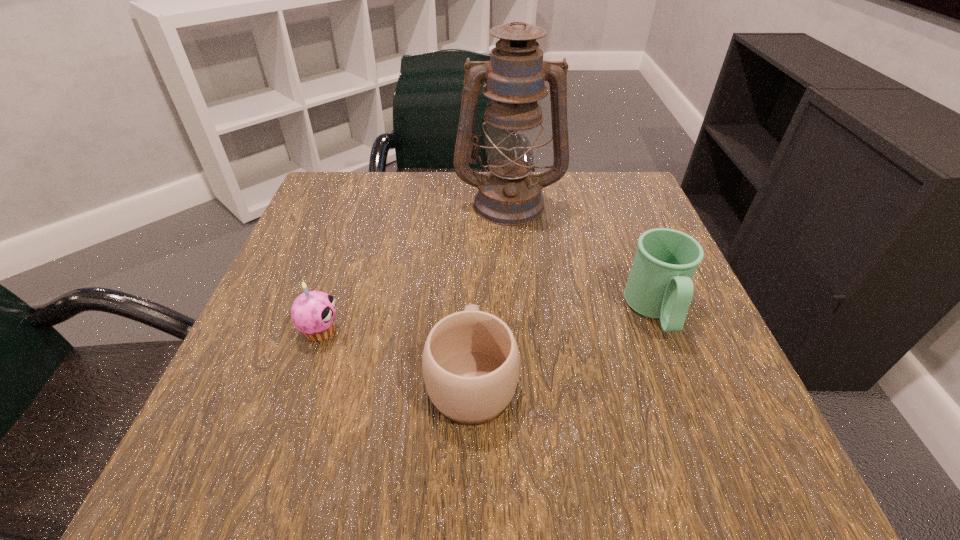
Where is `free space located on the side of the left mug with the handle`? The width and height of the screenshot is (960, 540). free space located on the side of the left mug with the handle is located at coordinates (473, 290).

I want to click on object present at the far edge, so click(x=509, y=194).

The image size is (960, 540). In order to click on object that is at the near edge in this screenshot , I will do `click(470, 361)`.

What are the coordinates of `object situated at the left edge` in the screenshot? It's located at (313, 313).

This screenshot has width=960, height=540. I want to click on object that is at the right edge, so click(660, 286).

Image resolution: width=960 pixels, height=540 pixels. In the image, there is a desktop. Find the location of `vacant space at the far edge`. vacant space at the far edge is located at coordinates (561, 180).

You are a GUI agent. You are given a task and a screenshot of the screen. Output one action in this format:
    pyautogui.click(x=<x>, y=<y>)
    Task: Click on the free location at the near edge of the desktop
    The width and height of the screenshot is (960, 540).
    Given the screenshot: What is the action you would take?
    pyautogui.click(x=406, y=476)

I want to click on free space at the left edge of the desktop, so click(x=331, y=239).

Where is `free space at the right edge of the desktop`? This screenshot has height=540, width=960. free space at the right edge of the desktop is located at coordinates (710, 370).

Where is `vacant position at the far left corner of the desktop`? vacant position at the far left corner of the desktop is located at coordinates (343, 220).